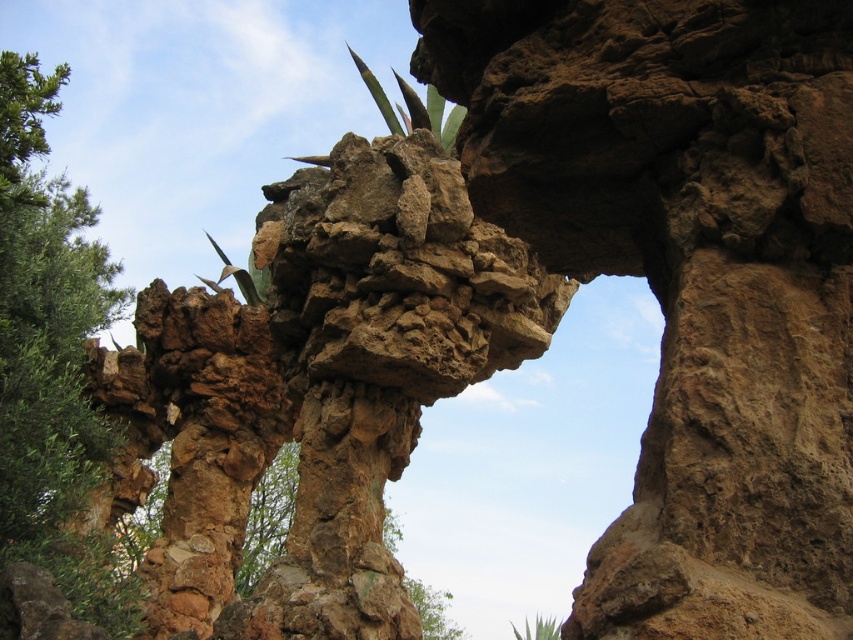
Question: Can you confirm if green leafy tree at left is thinner than green leafy plant at lower center?

Choices:
 (A) yes
 (B) no

Answer: (B)

Question: Which object is farther from the camera taking this photo?

Choices:
 (A) green leafy tree at left
 (B) green leafy plant at lower center

Answer: (B)

Question: Does green leafy tree at left appear on the left side of green leafy plant at lower center?

Choices:
 (A) yes
 (B) no

Answer: (A)

Question: Does green leafy tree at left have a smaller size compared to green leafy plant at lower center?

Choices:
 (A) no
 (B) yes

Answer: (A)

Question: Which of the following is the closest to the observer?

Choices:
 (A) green leafy plant at lower center
 (B) green leafy tree at left

Answer: (B)

Question: Which point is closer to the camera?

Choices:
 (A) green leafy plant at lower center
 (B) green leafy tree at left

Answer: (B)